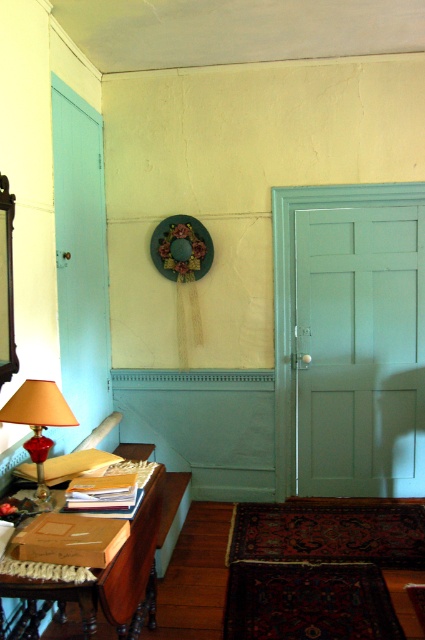
Question: Is wooden table at lower left above green fabric wreath at upper center?

Choices:
 (A) no
 (B) yes

Answer: (A)

Question: Which object is the closest to the matte red glass lamp at left?

Choices:
 (A) wooden table at lower left
 (B) matte white door at right
 (C) green fabric wreath at upper center

Answer: (A)

Question: Considering the real-world distances, which object is farthest from the green fabric wreath at upper center?

Choices:
 (A) matte white door at right
 (B) matte red glass lamp at left

Answer: (B)

Question: Does wooden table at lower left appear on the right side of green fabric wreath at upper center?

Choices:
 (A) no
 (B) yes

Answer: (A)

Question: Is matte white door at right smaller than matte red glass lamp at left?

Choices:
 (A) yes
 (B) no

Answer: (B)

Question: Which of these objects is positioned closest to the matte red glass lamp at left?

Choices:
 (A) green fabric wreath at upper center
 (B) wooden table at lower left

Answer: (B)